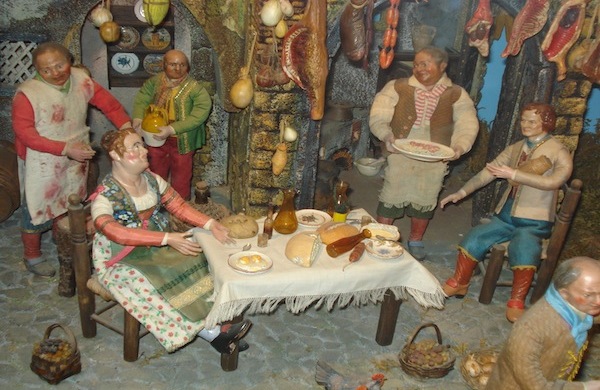
Identify the location of plates. The width and height of the screenshot is (600, 390). (127, 40), (123, 60), (148, 63), (152, 43), (138, 13), (255, 273), (313, 216), (420, 156).